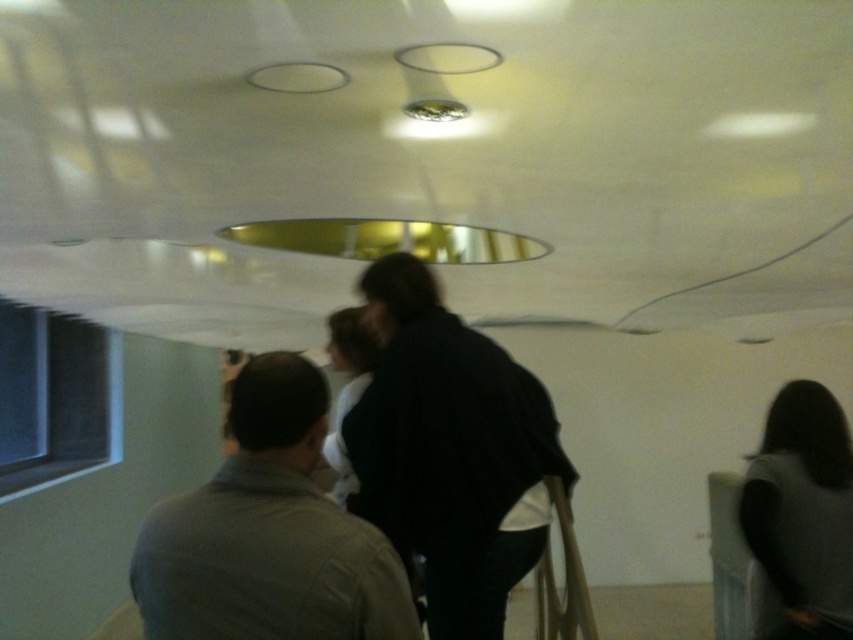
You are standing in the construction area and need to locate the black matte jacket at center and the dark gray fabric at lower right. Which object is positioned closer to the left side from your viewpoint?

The black matte jacket at center is to the left of dark gray fabric at lower right, so the black matte jacket at center is closer to the left side.

You are a safety inspector checking the construction site. You notice the gray cotton shirt at center and the dark gray fabric at lower right. Which object is covering the other?

The gray cotton shirt at center is positioned over the dark gray fabric at lower right, so it is covering it.

You are a construction worker who needs to place a 1.2 meter wide tool box between the gray cotton shirt at center and the dark gray fabric at lower right. Based on their widths, will the tool box fit between them?

The gray cotton shirt at center might be wider than dark gray fabric at lower right, so the tool box may not fit between them if the total width of both objects exceeds 1.2 meters. However, without exact measurements, it is uncertain.